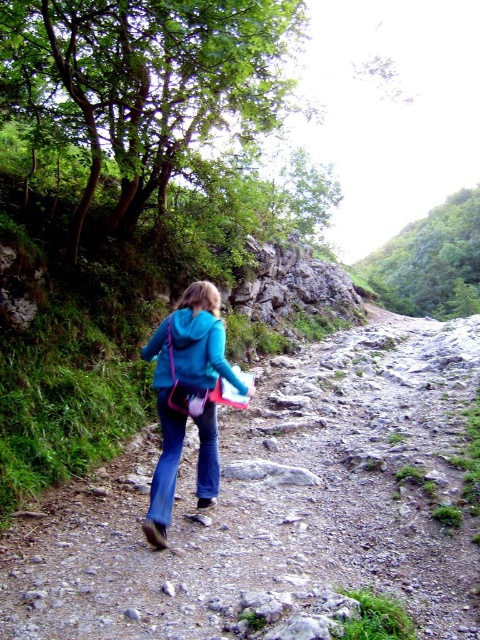
You are a hiker trying to decide whether to step onto the dusty gravel path at center or the matte blue jacket at center. Which one is closer to you?

The dusty gravel path at center is closer to the viewer than the matte blue jacket at center, so you should step onto the dusty gravel path at center first.

Consider the image. You are a hiker trying to locate your friend who is wearing a teal matte jacket at center. According to the map, your friend is standing at point (188,397). Can you confirm if your friend is at that location?

Yes, the teal matte jacket at center is located at point (188,397), so your friend is at that location.

You are a hiker trying to follow the path. You see the dusty gravel path at center and the matte blue jacket at center. Which object is located to the left of the other?

The dusty gravel path at center is to the left of the matte blue jacket at center.